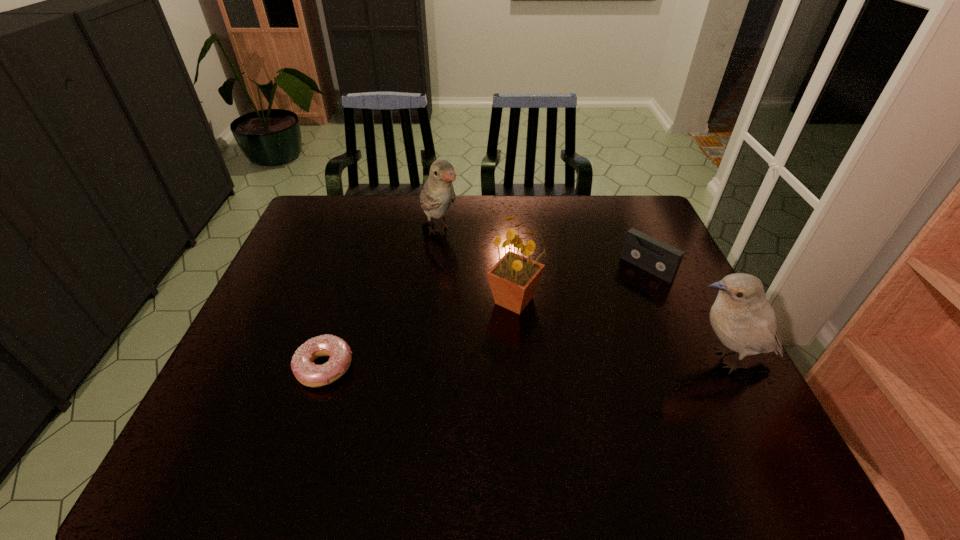
What are the coordinates of `free location located at the beak of the nearer bird` in the screenshot? It's located at (559, 360).

The width and height of the screenshot is (960, 540). Find the location of `free spot located 0.100m on the front-facing side of the videotape`. free spot located 0.100m on the front-facing side of the videotape is located at coordinates (616, 296).

This screenshot has width=960, height=540. I want to click on free location located 0.320m on the front-facing side of the videotape, so click(x=569, y=339).

The image size is (960, 540). What are the coordinates of `free space located on the front-facing side of the videotape` in the screenshot? It's located at (589, 320).

What are the coordinates of `free space located at the front of the sunflower with flowers visible` in the screenshot? It's located at (527, 335).

Identify the location of vacant space located 0.270m at the front of the sunflower with flowers visible. (x=556, y=409).

The height and width of the screenshot is (540, 960). What are the coordinates of `vacant space located at the front of the sunflower with flowers visible` in the screenshot? It's located at (538, 363).

The height and width of the screenshot is (540, 960). Identify the location of free spot located 0.360m at the face of the farthest object. (513, 318).

This screenshot has height=540, width=960. In order to click on vacant space located 0.180m at the face of the farthest object in this screenshot , I will do `click(477, 279)`.

The width and height of the screenshot is (960, 540). What are the coordinates of `vacant space located at the face of the farthest object` in the screenshot? It's located at (479, 281).